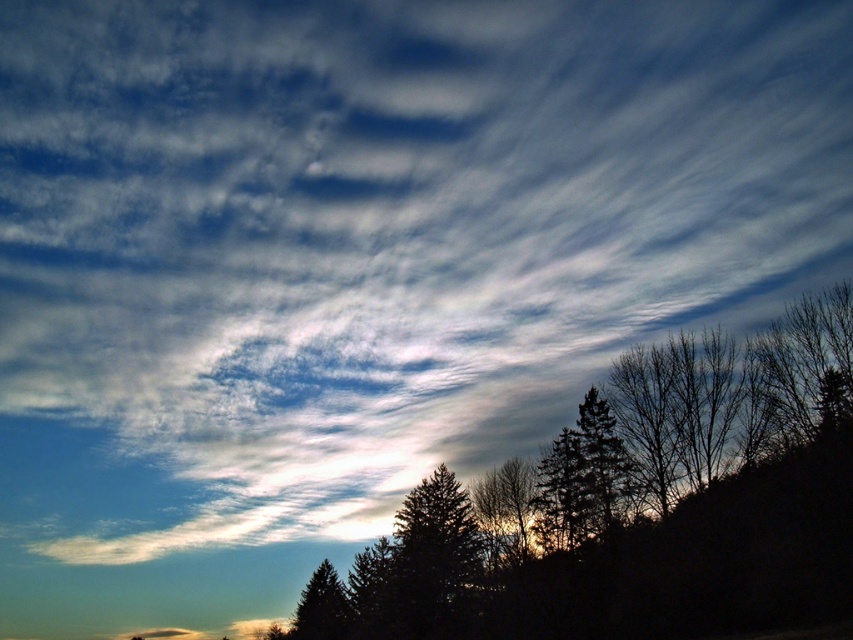
You are planning to plant a new tree between the dark green textured tree at center and the green matte tree at lower center. The new tree requires a minimum of 40 meters of space between it and the existing trees. Is there enough space to plant it?

The dark green textured tree at center and green matte tree at lower center are 43.51 meters apart, so yes, there is enough space to plant the new tree between them as the required minimum distance of 40 meters is met.

You are standing at the base of the hillside in the image and want to reach the point marked as point (331, 608). However, there is an obstacle at point (605, 449). Will you encounter this obstacle before reaching your destination?

Yes, you will encounter the obstacle at point (605, 449) before reaching point (331, 608) because point (605, 449) is in front of point (331, 608).